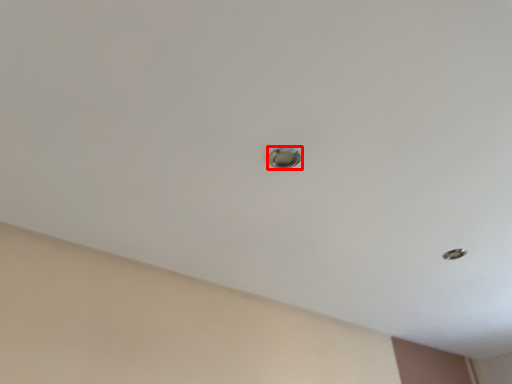
Question: From the image's perspective, where is door handle (annotated by the red box) located in relation to hole in the image?

Choices:
 (A) above
 (B) below

Answer: (A)